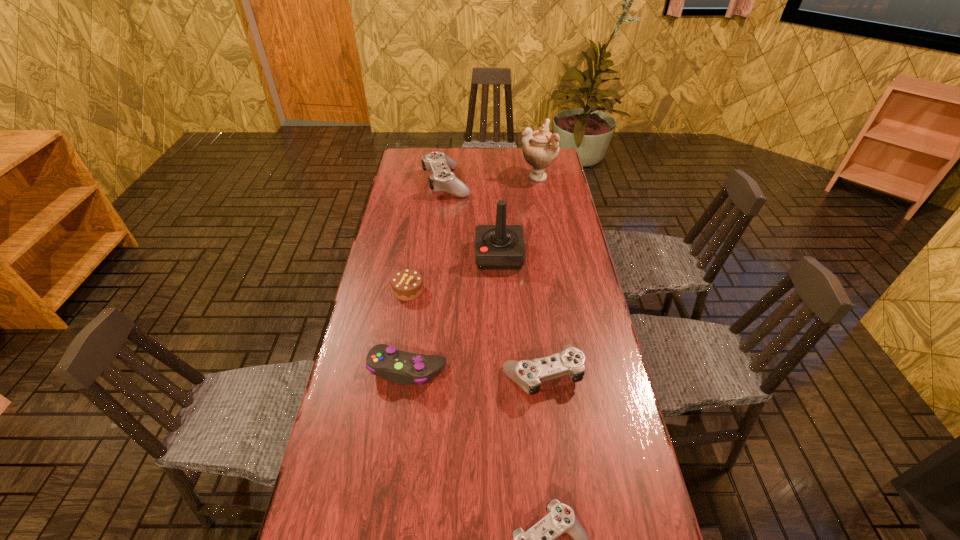
The width and height of the screenshot is (960, 540). Find the location of `urn`. urn is located at coordinates (540, 148).

The height and width of the screenshot is (540, 960). I want to click on the fifth nearest object, so click(x=497, y=247).

Locate an element on the screen. This screenshot has width=960, height=540. joystick is located at coordinates (497, 247).

You are a GUI agent. You are given a task and a screenshot of the screen. Output one action in this format:
    pyautogui.click(x=<x>, y=<y>)
    Task: Click on the third tallest object
    The height and width of the screenshot is (540, 960).
    Given the screenshot: What is the action you would take?
    pyautogui.click(x=442, y=178)

You are a GUI agent. You are given a task and a screenshot of the screen. Output one action in this format:
    pyautogui.click(x=<x>, y=<y>)
    Task: Click on the biggest white control
    Image resolution: width=960 pixels, height=540 pixels.
    Given the screenshot: What is the action you would take?
    pyautogui.click(x=442, y=178)

Locate an element on the screen. gray control is located at coordinates (397, 366).

The height and width of the screenshot is (540, 960). What are the coordinates of `the second farthest white control` in the screenshot? It's located at (528, 374).

Locate an element on the screen. the fourth nearest object is located at coordinates (407, 285).

Identify the location of chocolate cake. (407, 285).

Where is `free location located 0.060m on the left of the urn`? Image resolution: width=960 pixels, height=540 pixels. free location located 0.060m on the left of the urn is located at coordinates (505, 177).